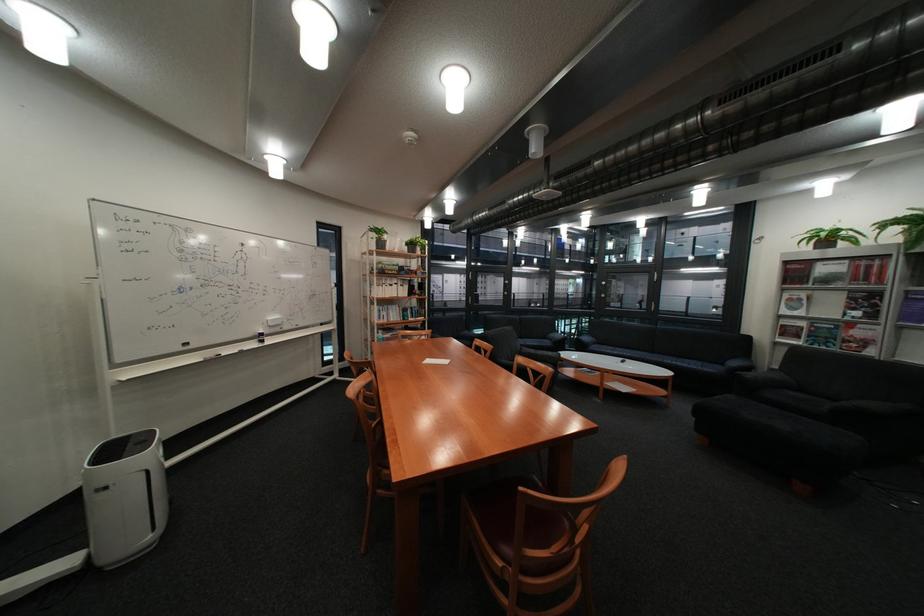
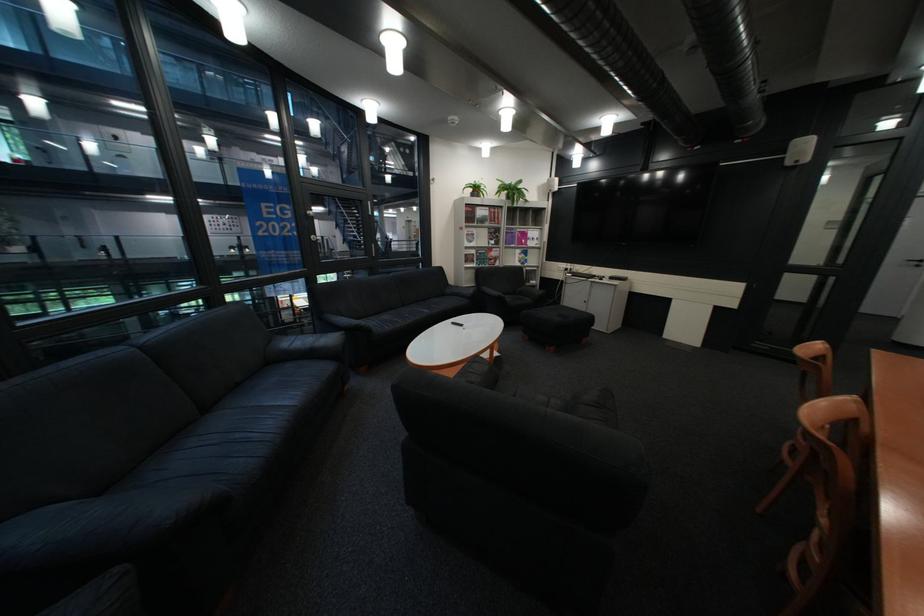
The point at (x=865, y=299) is marked in the first image. Where is the corresponding point in the second image?

(505, 233)